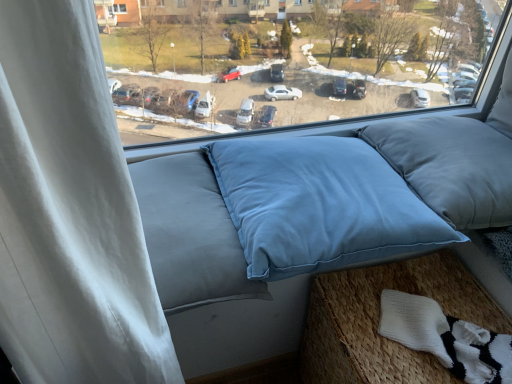
Locate an element on the screen. This screenshot has width=512, height=384. free location above blue fabric pillow at center, which appears as the 2th pillow when viewed from the right (from a real-world perspective) is located at coordinates (311, 161).